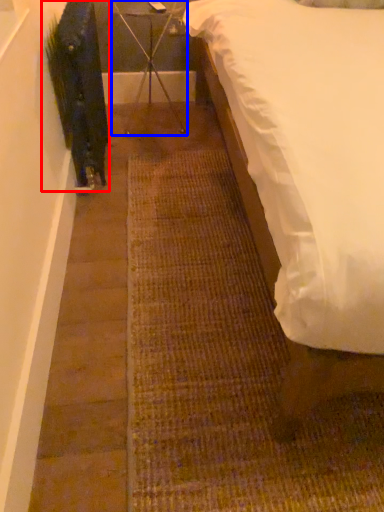
Question: Which of the following is the farthest to the observer, plant (highlighted by a red box) or furniture (highlighted by a blue box)?

Choices:
 (A) plant
 (B) furniture

Answer: (B)